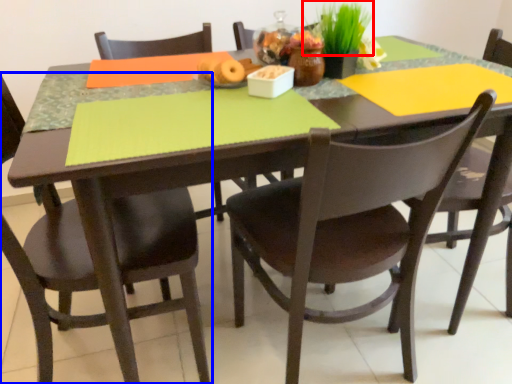
Question: Which object appears farthest to the camera in this image, plant (highlighted by a red box) or chair (highlighted by a blue box)?

Choices:
 (A) plant
 (B) chair

Answer: (A)